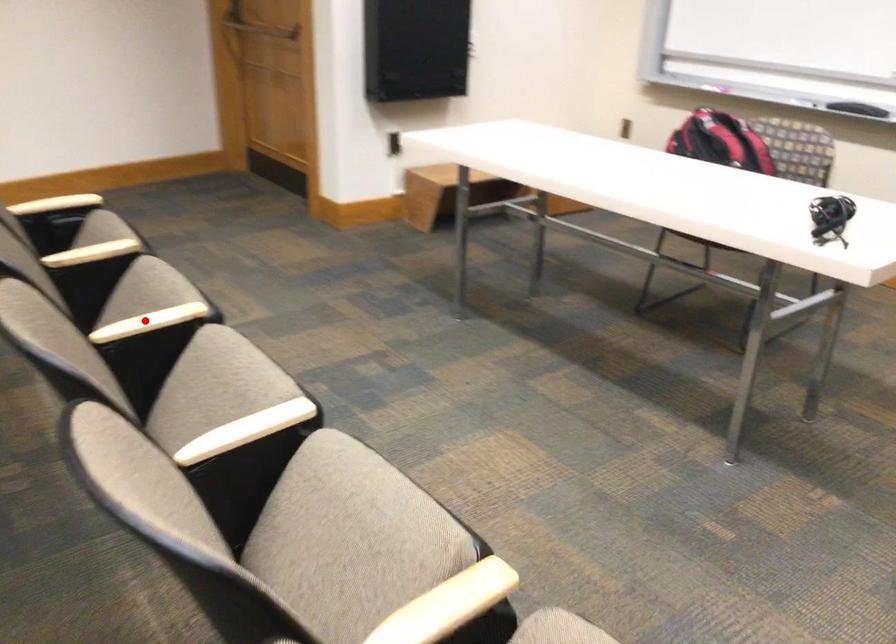
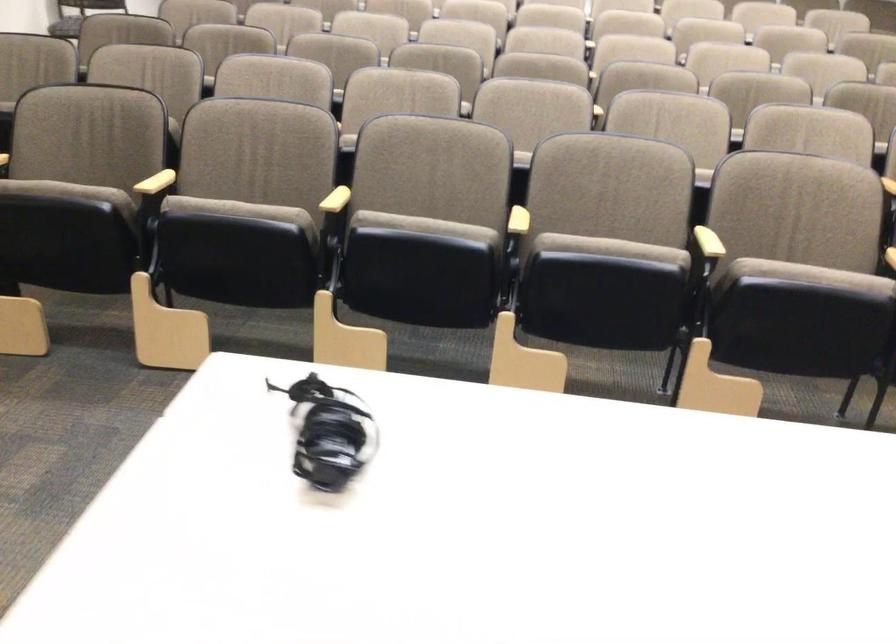
Find the pixel in the second image that matches the highlighted location in the first image.

(709, 242)